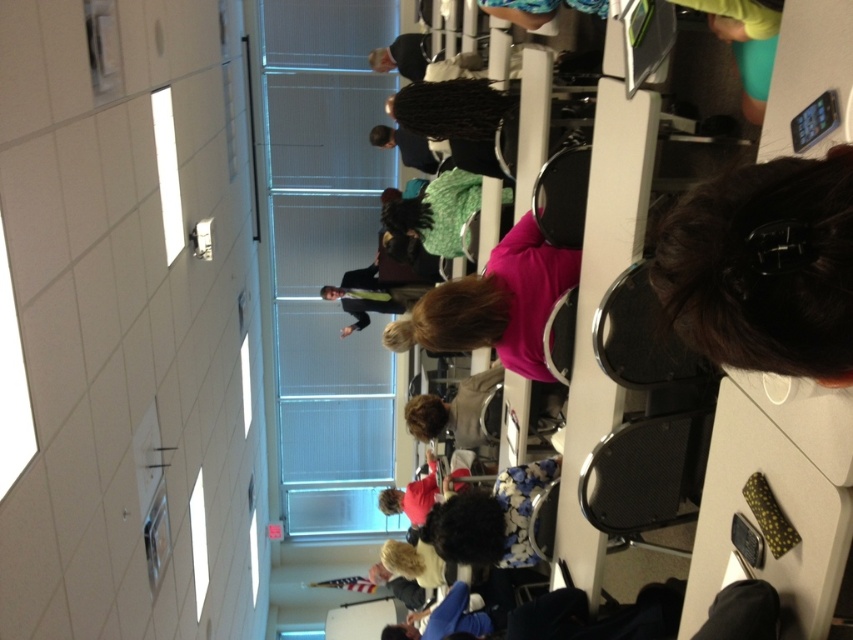
Question: Does dark brown hair at upper right appear on the left side of pink matte shirt at center?

Choices:
 (A) yes
 (B) no

Answer: (B)

Question: Can you confirm if dark brown hair at upper right is positioned to the left of pink matte shirt at center?

Choices:
 (A) yes
 (B) no

Answer: (B)

Question: Which object appears closest to the camera in this image?

Choices:
 (A) dark brown hair at upper right
 (B) pink matte shirt at center

Answer: (A)

Question: Which of the following is the farthest from the observer?

Choices:
 (A) dark brown hair at upper right
 (B) pink matte shirt at center

Answer: (B)

Question: Which point is farther to the camera?

Choices:
 (A) (718, 192)
 (B) (529, 340)

Answer: (B)

Question: From the image, what is the correct spatial relationship of dark brown hair at upper right in relation to pink matte shirt at center?

Choices:
 (A) below
 (B) above

Answer: (A)